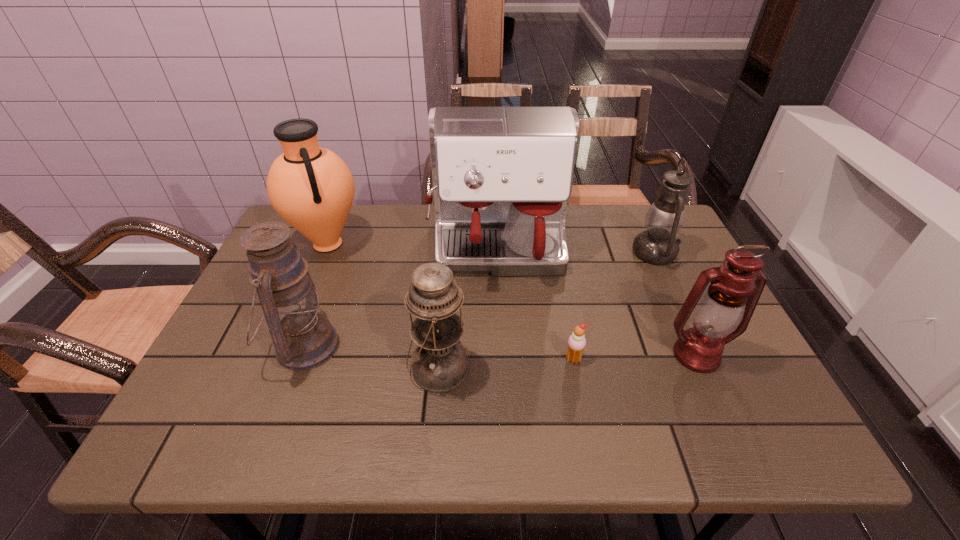
Find the location of a particular element. The width and height of the screenshot is (960, 540). object that is the fourth closest to the leftmost oil lamp is located at coordinates (576, 343).

You are a GUI agent. You are given a task and a screenshot of the screen. Output one action in this format:
    pyautogui.click(x=<x>, y=<y>)
    Task: Click on the object identified as the closest to the farthest oil lamp
    Image resolution: width=960 pixels, height=540 pixels.
    Given the screenshot: What is the action you would take?
    point(502,177)

Point out which oil lamp is positioned as the third nearest to the farthest oil lamp. Please provide its 2D coordinates. Your answer should be formatted as a tuple, i.e. [(x, y)], where the tuple contains the x and y coordinates of a point satisfying the conditions above.

[(303, 339)]

The height and width of the screenshot is (540, 960). Identify the location of oil lamp that is the fourth closest to the shortest object. (303, 339).